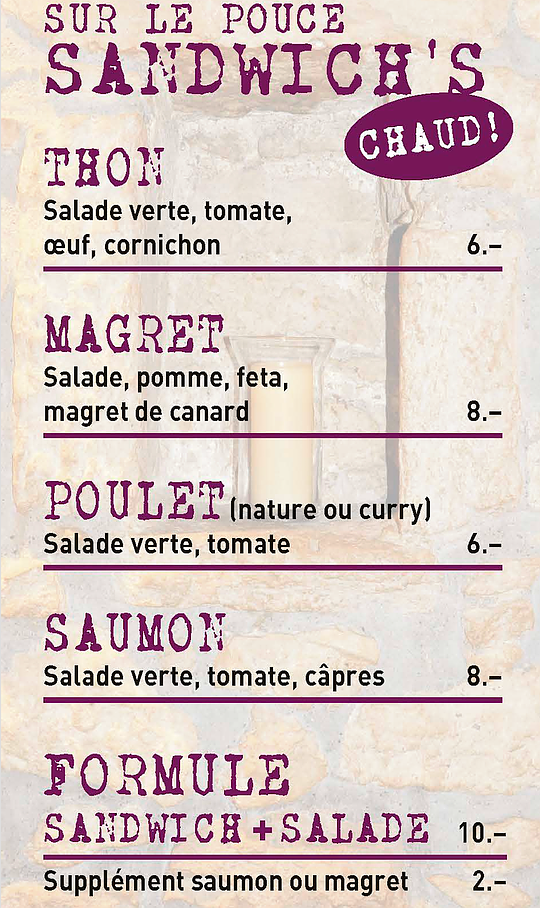
Where is `clear candle holder`? This screenshot has height=908, width=540. clear candle holder is located at coordinates (318, 341).